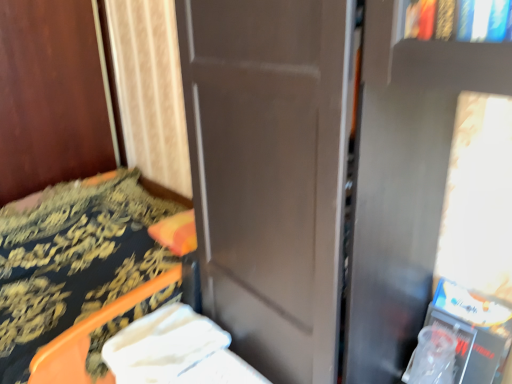
What do you see at coordinates (163, 345) in the screenshot?
I see `white fabric at lower left` at bounding box center [163, 345].

What is the approximate height of white fabric at lower left?

The height of white fabric at lower left is 16.28 inches.

Image resolution: width=512 pixels, height=384 pixels. I want to click on white fabric at lower left, so click(163, 345).

Identify the location of orange plastic chair at lower left. Image resolution: width=512 pixels, height=384 pixels. (73, 260).

Describe the element at coordinates (73, 260) in the screenshot. I see `orange plastic chair at lower left` at that location.

Locate an element on the screen. white fabric at lower left is located at coordinates (163, 345).

Between white fabric at lower left and orange plastic chair at lower left, which one appears on the left side from the viewer's perspective?

orange plastic chair at lower left.

In the image, is white fabric at lower left positioned in front of or behind orange plastic chair at lower left?

In the image, white fabric at lower left appears behind orange plastic chair at lower left.

Between point (137, 343) and point (2, 367), which one is positioned behind?

Point (2, 367)

From the image's perspective, would you say white fabric at lower left is positioned over orange plastic chair at lower left?

No, from the image's perspective, white fabric at lower left is not over orange plastic chair at lower left.

From a real-world perspective, is white fabric at lower left above or below orange plastic chair at lower left?

Clearly, from a real-world perspective, white fabric at lower left is below orange plastic chair at lower left.

Which of these two, white fabric at lower left or orange plastic chair at lower left, is thinner?

white fabric at lower left.

Is white fabric at lower left shorter than orange plastic chair at lower left?

Yes.

Does white fabric at lower left have a smaller size compared to orange plastic chair at lower left?

Correct, white fabric at lower left occupies less space than orange plastic chair at lower left.

Can we say white fabric at lower left lies outside orange plastic chair at lower left?

white fabric at lower left is positioned outside orange plastic chair at lower left.

Consider the image. Can you see white fabric at lower left touching orange plastic chair at lower left?

There is a gap between white fabric at lower left and orange plastic chair at lower left.

Does white fabric at lower left turn towards orange plastic chair at lower left?

No, white fabric at lower left does not turn towards orange plastic chair at lower left.

How far apart are white fabric at lower left and orange plastic chair at lower left?

white fabric at lower left is 18.29 inches from orange plastic chair at lower left.

The height and width of the screenshot is (384, 512). What are the coordinates of `sheet directly beneath the orange plastic chair at lower left (from a real-world perspective)` in the screenshot? It's located at (163, 345).

Does orange plastic chair at lower left appear on the right side of white fabric at lower left?

No.

Which object is more forward, orange plastic chair at lower left or white fabric at lower left?

orange plastic chair at lower left is more forward.

Is point (34, 223) in front of point (170, 334)?

No, (34, 223) is further to viewer.

From the image's perspective, between orange plastic chair at lower left and white fabric at lower left, who is located below?

white fabric at lower left appears lower in the image.

From a real-world perspective, is orange plastic chair at lower left positioned over white fabric at lower left based on gravity?

Correct, in the physical world, orange plastic chair at lower left is higher than white fabric at lower left.

Between orange plastic chair at lower left and white fabric at lower left, which one has larger width?

Wider between the two is orange plastic chair at lower left.

Is orange plastic chair at lower left taller than white fabric at lower left?

Yes, orange plastic chair at lower left is taller than white fabric at lower left.

Which of these two, orange plastic chair at lower left or white fabric at lower left, is smaller?

Smaller between the two is white fabric at lower left.

Is white fabric at lower left a part of orange plastic chair at lower left?

No, white fabric at lower left is not a part of orange plastic chair at lower left.

Are orange plastic chair at lower left and white fabric at lower left making contact?

They are not placed beside each other.

Is orange plastic chair at lower left oriented towards white fabric at lower left?

No, orange plastic chair at lower left does not turn towards white fabric at lower left.

Can you tell me how much orange plastic chair at lower left and white fabric at lower left differ in facing direction?

They differ by 0.809 degrees in their facing directions.

Measure the distance between orange plastic chair at lower left and white fabric at lower left.

The distance of orange plastic chair at lower left from white fabric at lower left is 46.45 centimeters.

This screenshot has width=512, height=384. What are the coordinates of `furniture on the left of the white fabric at lower left` in the screenshot? It's located at (73, 260).

Where is `furniture above the white fabric at lower left (from the image's perspective)`? The height and width of the screenshot is (384, 512). furniture above the white fabric at lower left (from the image's perspective) is located at coordinates (73, 260).

Image resolution: width=512 pixels, height=384 pixels. In the image, there is a orange plastic chair at lower left. Identify the location of sheet below it (from a real-world perspective). (163, 345).